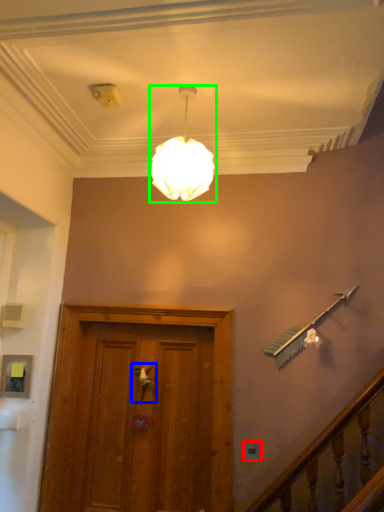
Question: Which is farther away from electric outlet (highlighted by a red box)? door handle (highlighted by a blue box) or lamp (highlighted by a green box)?

Choices:
 (A) door handle
 (B) lamp

Answer: (B)